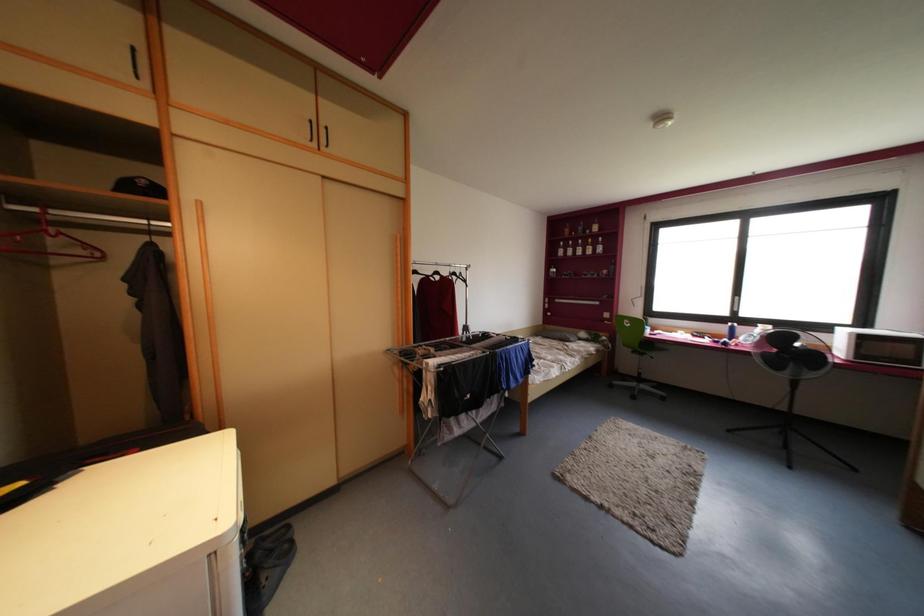
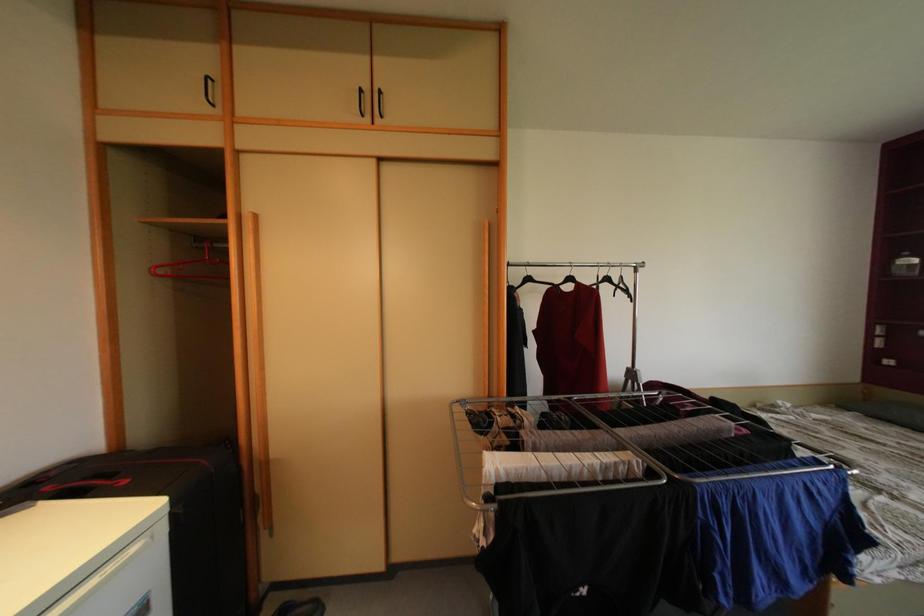
Question: The images are taken continuously from a first-person perspective. In which direction is your viewpoint rotating?

Choices:
 (A) Left
 (B) Right
 (C) Up
 (D) Down

Answer: (A)